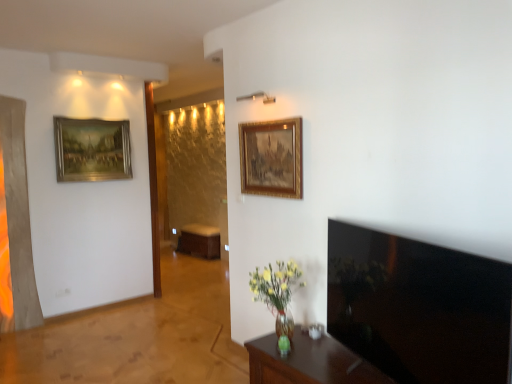
Question: Which is correct: gold-framed painting at upper left, the second picture frame from the front, is inside brown wooden table at center, or outside of it?

Choices:
 (A) outside
 (B) inside

Answer: (A)

Question: Is point (104, 142) positioned closer to the camera than point (209, 233)?

Choices:
 (A) closer
 (B) farther

Answer: (A)

Question: Which is nearer to the gold/gilded picture frame at upper center, positioned as the second picture frame in back-to-front order?

Choices:
 (A) black glossy tv at right
 (B) brown wooden table at center
 (C) gold-framed painting at upper left, the second picture frame from the front
 (D) brown wooden table at lower right

Answer: (A)

Question: Which of these objects is positioned farthest from the brown wooden table at center?

Choices:
 (A) black glossy tv at right
 (B) brown wooden table at lower right
 (C) gold-framed painting at upper left, the second picture frame from the front
 (D) gold/gilded picture frame at upper center, positioned as the second picture frame in back-to-front order

Answer: (A)